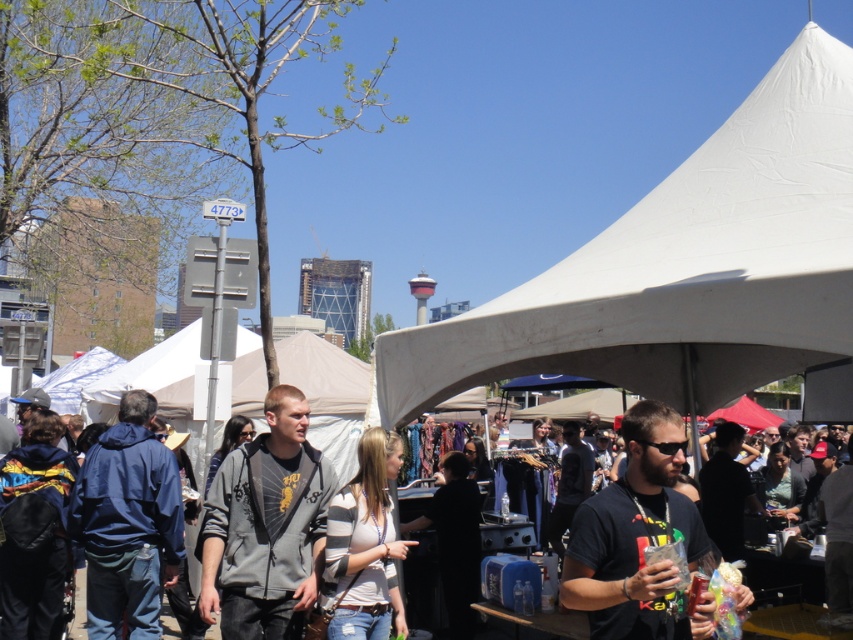
Between point (291, 600) and point (675, 534), which one is positioned behind?

The point (291, 600) is more distant.

Where is `gray fleece jacket at center`? The width and height of the screenshot is (853, 640). gray fleece jacket at center is located at coordinates (265, 525).

Consider the image. Is white fabric canopy at upper center to the left of black matte t-shirt at center from the viewer's perspective?

No, white fabric canopy at upper center is not to the left of black matte t-shirt at center.

Who is higher up, white fabric canopy at upper center or black matte t-shirt at center?

Positioned higher is white fabric canopy at upper center.

Is point (463, 330) positioned behind point (634, 538)?

That is True.

Where is `white fabric canopy at upper center`? white fabric canopy at upper center is located at coordinates (682, 268).

Is striped cotton shirt at center positioned in front of dark gray hoodie at center?

That is True.

Which is in front, point (352, 515) or point (279, 419)?

Point (279, 419)

Locate an element on the screen. This screenshot has height=640, width=853. striped cotton shirt at center is located at coordinates (364, 545).